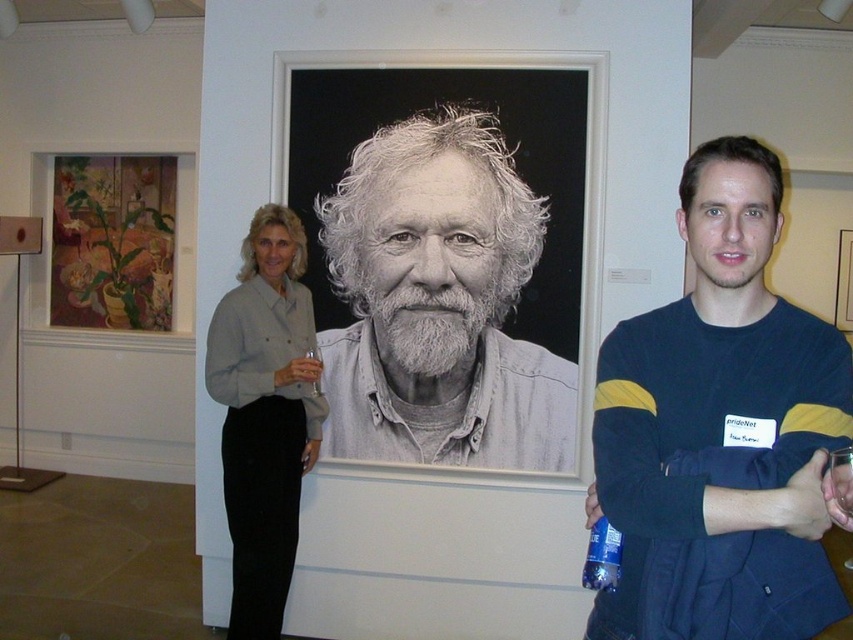
Question: Can you confirm if light gray shirt at center is positioned below floral painting at upper left?

Choices:
 (A) yes
 (B) no

Answer: (A)

Question: Is gray matte portrait at center positioned before light gray shirt at center?

Choices:
 (A) no
 (B) yes

Answer: (A)

Question: Which point appears farthest from the camera in this image?

Choices:
 (A) (233, 312)
 (B) (86, 228)
 (C) (369, 416)
 (D) (619, 552)

Answer: (B)

Question: Which point is farther to the camera?

Choices:
 (A) blue plastic bottle at center
 (B) light gray shirt at center
 (C) floral painting at upper left

Answer: (C)

Question: Where is dark blue sweater at right located in relation to floral painting at upper left in the image?

Choices:
 (A) left
 (B) right

Answer: (B)

Question: Among these objects, which one is nearest to the camera?

Choices:
 (A) light gray shirt at center
 (B) blue plastic bottle at center
 (C) dark blue sweater at right

Answer: (C)